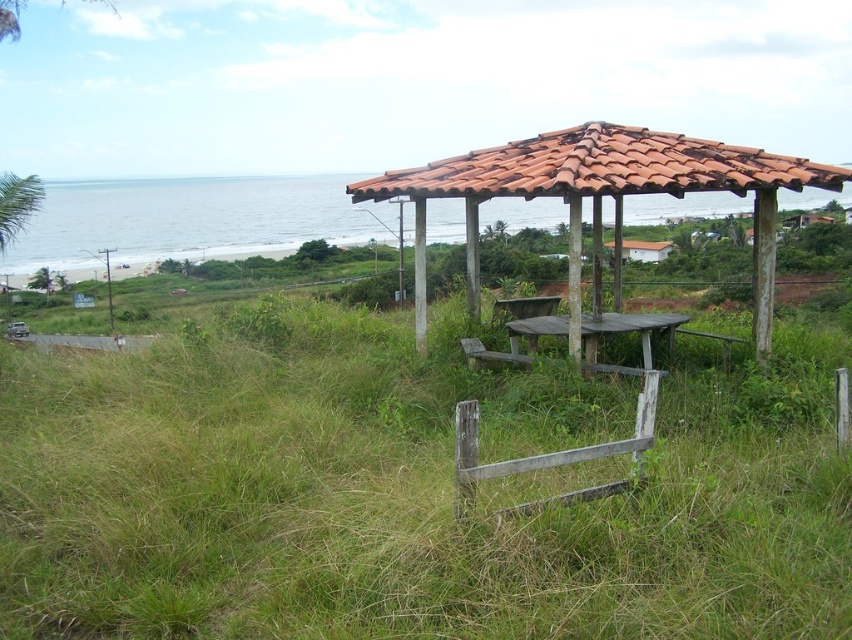
You are planning to set up a small tent for a picnic. The tent requires at least 10 feet of space between the green grassy at center and the wooden picnic table at center. Based on the scene, is there enough space?

The distance between the green grassy at center and the wooden picnic table at center is 8.89 feet, which is less than the required 10 feet. Therefore, there is not enough space to set up the tent.

You are standing at the beach and want to take a photo of both the rustic wooden structure and the ocean. You notice two points marked in the scene. The first point is at coordinate point(528, 204) and the second is at point(469, 339). Which point should you stand closer to in order to ensure both the rustic wooden structure and the ocean are in frame?

You should stand closer to point(469, 339) because point(528, 204) is further away from the camera, so positioning yourself near the closer point will help keep both the rustic wooden structure and the ocean within the frame.